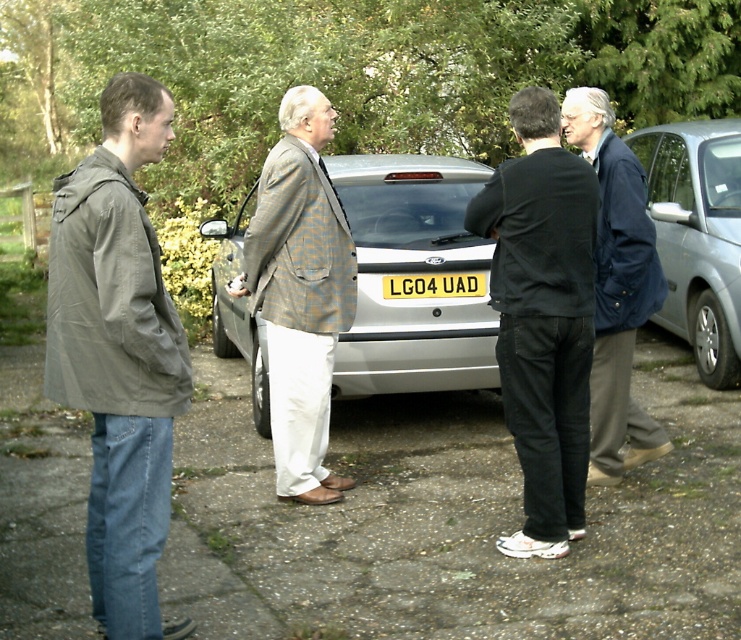
You are a photographer trying to capture a group photo of the four men standing near the silver metallic car at center and the black cotton shirt at center. Since you want to ensure both the car and the shirt are clearly visible in the photo, which object should you focus on first to ensure proper framing?

The silver metallic car at center is larger in size than the black cotton shirt at center, so focusing on the car first will help ensure both objects are properly framed in the photo.

You are a delivery person carrying a package that requires a 1.2 meter clearance to maneuver safely. You need to pass between the plaid wool blazer at center and the yellow matte license plate at center. Is there enough space for you to pass safely?

The plaid wool blazer at center is 1.03 meters away from the yellow matte license plate at center. Since the required clearance is 1.2 meters, the distance is insufficient. You cannot pass safely between them.